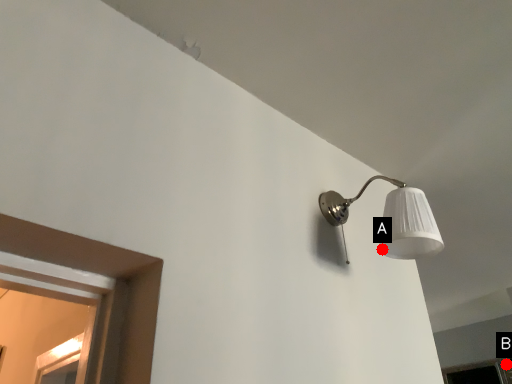
Question: Two points are circled on the image, labeled by A and B beside each circle. Which point appears closest to the camera in this image?

Choices:
 (A) A is closer
 (B) B is closer

Answer: (A)